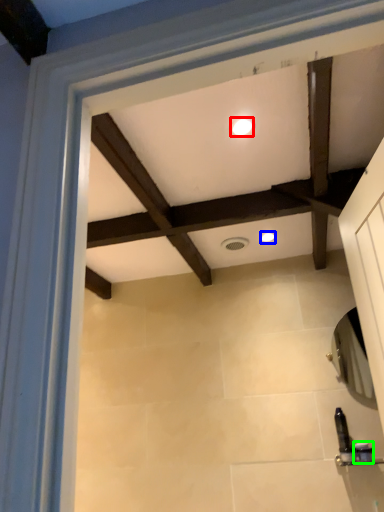
Question: Based on their relative distances, which object is nearer to lighting (highlighted by a red box)? Choose from lighting (highlighted by a blue box) and toiletry (highlighted by a green box).

Choices:
 (A) lighting
 (B) toiletry

Answer: (A)